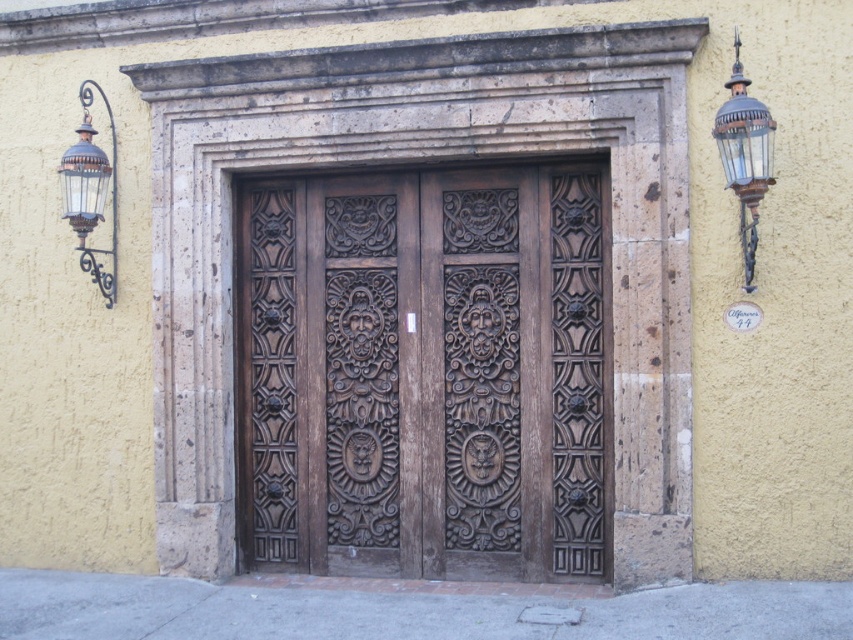
Based on the photo, you are an architect examining the building facade. You notice the dark brown wood door at center and the antique brass lantern at upper right. Which object is positioned higher on the facade?

The antique brass lantern at upper right is positioned higher on the facade than the dark brown wood door at center.